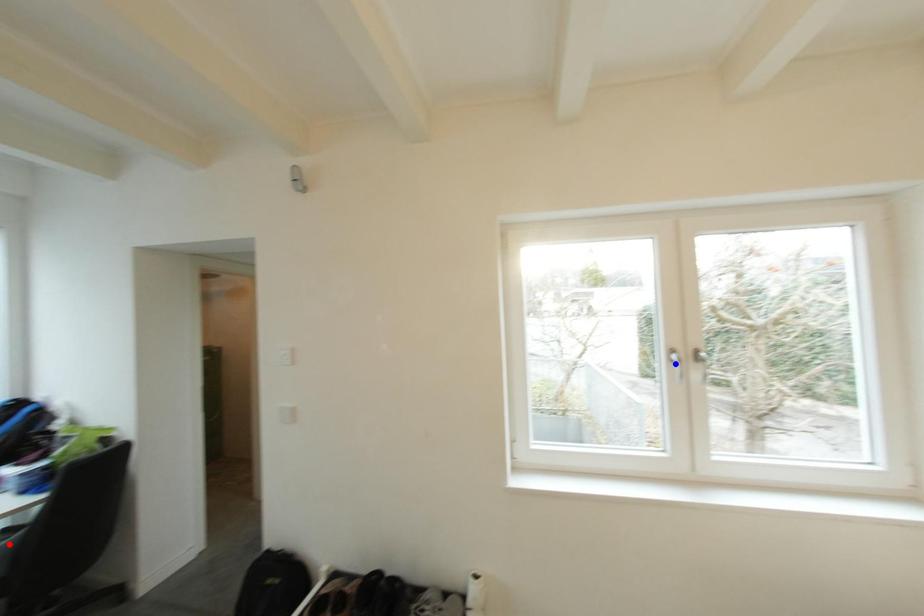
Question: Which of the two points in the image is closer to the camera?

Choices:
 (A) Blue point is closer.
 (B) Red point is closer.

Answer: (B)